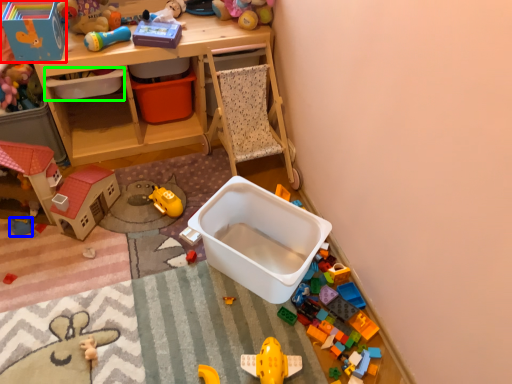
Question: Which is farther away from toy (highlighted by a red box)? toy (highlighted by a blue box) or storage box (highlighted by a green box)?

Choices:
 (A) toy
 (B) storage box

Answer: (A)